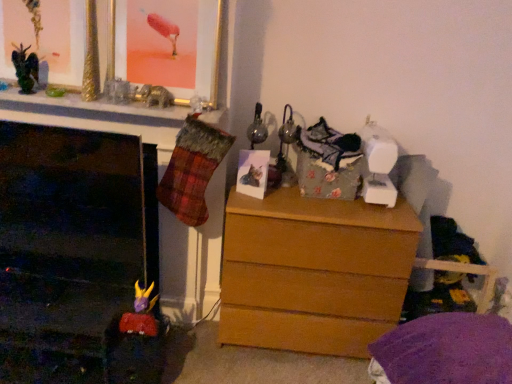
In order to face matte paper photo at center, the 2th picture frame viewed from the top, should I rotate leftwards or rightwards?

Turn right by 0.031 degrees to look at matte paper photo at center, the 2th picture frame viewed from the top.

This screenshot has height=384, width=512. What do you see at coordinates (313, 272) in the screenshot?
I see `light brown wood chest of drawers at center` at bounding box center [313, 272].

Locate an element on the screen. Image resolution: width=512 pixels, height=384 pixels. matte paper photo at center, which is the 2th picture frame in left-to-right order is located at coordinates (253, 172).

Can you confirm if gold metallic picture frame at upper center, the 2th picture frame viewed from the right, is taller than matte paper photo at center, the 1th picture frame in the right-to-left sequence?

Yes, gold metallic picture frame at upper center, the 2th picture frame viewed from the right, is taller than matte paper photo at center, the 1th picture frame in the right-to-left sequence.

Can we say gold metallic picture frame at upper center, marked as the first picture frame in a top-to-bottom arrangement, lies outside matte paper photo at center, the 2th picture frame viewed from the top?

That's correct, gold metallic picture frame at upper center, marked as the first picture frame in a top-to-bottom arrangement, is outside of matte paper photo at center, the 2th picture frame viewed from the top.

Looking at the image, does gold metallic picture frame at upper center, marked as the first picture frame in a top-to-bottom arrangement, seem bigger or smaller compared to matte paper photo at center, the 2th picture frame viewed from the top?

Considering their sizes, gold metallic picture frame at upper center, marked as the first picture frame in a top-to-bottom arrangement, takes up more space than matte paper photo at center, the 2th picture frame viewed from the top.

From the image's perspective, who appears lower, matte paper photo at center, which is the 1th picture frame from bottom to top, or metallic black dragon at upper left?

matte paper photo at center, which is the 1th picture frame from bottom to top.

Is matte paper photo at center, the 1th picture frame in the right-to-left sequence, oriented towards metallic black dragon at upper left?

No, matte paper photo at center, the 1th picture frame in the right-to-left sequence, is not turned towards metallic black dragon at upper left.

Which point is more forward, (263, 195) or (25, 92)?

The point (25, 92) is closer.

From the image's perspective, is matte paper photo at center, which is the 1th picture frame from bottom to top, above gold metallic picture frame at upper center, marked as the first picture frame in a top-to-bottom arrangement?

No, from the image's perspective, matte paper photo at center, which is the 1th picture frame from bottom to top, is not above gold metallic picture frame at upper center, marked as the first picture frame in a top-to-bottom arrangement.

Consider the image. Between matte paper photo at center, which is the 2th picture frame in left-to-right order, and gold metallic picture frame at upper center, the 2th picture frame viewed from the right, which one appears on the left side from the viewer's perspective?

gold metallic picture frame at upper center, the 2th picture frame viewed from the right, is more to the left.

Between matte paper photo at center, which is the 1th picture frame from bottom to top, and gold metallic picture frame at upper center, arranged as the first picture frame when viewed from the left, which one has smaller size?

matte paper photo at center, which is the 1th picture frame from bottom to top, is smaller.

From a real-world perspective, relative to matte paper photo at center, the 2th picture frame viewed from the top, is metallic black dragon at upper left vertically above or below?

metallic black dragon at upper left is above matte paper photo at center, the 2th picture frame viewed from the top.

You are a GUI agent. You are given a task and a screenshot of the screen. Output one action in this format:
    pyautogui.click(x=<x>, y=<y>)
    Task: Click on the toy lying above the matte paper photo at center, which is the 1th picture frame from bottom to top (from the image's perspective)
    The image size is (512, 384).
    Given the screenshot: What is the action you would take?
    pyautogui.click(x=25, y=68)

Does point (22, 62) appear closer or farther from the camera than point (259, 170)?

Point (22, 62).

Which of these two, light brown wood chest of drawers at center or gold metallic picture frame at upper center, placed as the second picture frame when sorted from bottom to top, is smaller?

gold metallic picture frame at upper center, placed as the second picture frame when sorted from bottom to top.

Is point (231, 249) positioned behind point (134, 47)?

Yes, point (231, 249) is behind point (134, 47).

Between light brown wood chest of drawers at center and gold metallic picture frame at upper center, arranged as the first picture frame when viewed from the left, which one has more height?

With more height is light brown wood chest of drawers at center.

From a real-world perspective, count 2nd picture frames upward from the light brown wood chest of drawers at center and point to it. Please provide its 2D coordinates.

[(170, 46)]

Is the depth of matte paper photo at center, the 1th picture frame in the right-to-left sequence, greater than that of light brown wood chest of drawers at center?

That is True.

Is matte paper photo at center, which is the 1th picture frame from bottom to top, inside or outside of light brown wood chest of drawers at center?

matte paper photo at center, which is the 1th picture frame from bottom to top, cannot be found inside light brown wood chest of drawers at center.

Considering the sizes of matte paper photo at center, which is the 2th picture frame in left-to-right order, and light brown wood chest of drawers at center in the image, is matte paper photo at center, which is the 2th picture frame in left-to-right order, bigger or smaller than light brown wood chest of drawers at center?

Clearly, matte paper photo at center, which is the 2th picture frame in left-to-right order, is smaller in size than light brown wood chest of drawers at center.

Would you consider matte paper photo at center, which is the 1th picture frame from bottom to top, to be distant from light brown wood chest of drawers at center?

They are positioned close to each other.

Which object is wider, light brown wood chest of drawers at center or metallic black dragon at upper left?

light brown wood chest of drawers at center is wider.

What's the angular difference between light brown wood chest of drawers at center and metallic black dragon at upper left's facing directions?

There is a 0.484-degree angle between the facing directions of light brown wood chest of drawers at center and metallic black dragon at upper left.

Consider the image. Is light brown wood chest of drawers at center at the right side of metallic black dragon at upper left?

Correct, you'll find light brown wood chest of drawers at center to the right of metallic black dragon at upper left.

Which point is more distant from viewer, (280, 344) or (29, 62)?

Point (280, 344)

Find the location of a particular element. The width and height of the screenshot is (512, 384). picture frame on the right of the gold metallic picture frame at upper center, the 2th picture frame viewed from the right is located at coordinates (253, 172).

Find the location of a particular element. This screenshot has height=384, width=512. picture frame behind the metallic black dragon at upper left is located at coordinates (253, 172).

In the scene shown: Which object lies further to the anchor point light brown wood chest of drawers at center, matte paper photo at center, the 1th picture frame in the right-to-left sequence, or gold metallic picture frame at upper center, the 2th picture frame viewed from the right?

gold metallic picture frame at upper center, the 2th picture frame viewed from the right, is positioned further to the anchor light brown wood chest of drawers at center.

Considering their positions, is metallic black dragon at upper left positioned further to gold metallic picture frame at upper center, placed as the second picture frame when sorted from bottom to top, than matte paper photo at center, which is the 2th picture frame in left-to-right order?

metallic black dragon at upper left is positioned further to the anchor gold metallic picture frame at upper center, placed as the second picture frame when sorted from bottom to top.

Looking at the image, which one is located closer to gold metallic picture frame at upper center, arranged as the first picture frame when viewed from the left, metallic black dragon at upper left or light brown wood chest of drawers at center?

The object closer to gold metallic picture frame at upper center, arranged as the first picture frame when viewed from the left, is metallic black dragon at upper left.

Based on their spatial positions, is gold metallic picture frame at upper center, arranged as the first picture frame when viewed from the left, or light brown wood chest of drawers at center further from matte paper photo at center, the 2th picture frame viewed from the top?

gold metallic picture frame at upper center, arranged as the first picture frame when viewed from the left, lies further to matte paper photo at center, the 2th picture frame viewed from the top, than the other object.

Estimate the real-world distances between objects in this image. Which object is closer to matte paper photo at center, the 1th picture frame in the right-to-left sequence, light brown wood chest of drawers at center or gold metallic picture frame at upper center, placed as the second picture frame when sorted from bottom to top?

light brown wood chest of drawers at center is closer to matte paper photo at center, the 1th picture frame in the right-to-left sequence.

Looking at the image, which one is located further to gold metallic picture frame at upper center, placed as the second picture frame when sorted from bottom to top, matte paper photo at center, which is the 2th picture frame in left-to-right order, or light brown wood chest of drawers at center?

light brown wood chest of drawers at center.

From the image, which object appears to be nearer to metallic black dragon at upper left, light brown wood chest of drawers at center or matte paper photo at center, which is the 2th picture frame in left-to-right order?

Among the two, matte paper photo at center, which is the 2th picture frame in left-to-right order, is located nearer to metallic black dragon at upper left.

Considering their positions, is matte paper photo at center, which is the 1th picture frame from bottom to top, positioned closer to metallic black dragon at upper left than light brown wood chest of drawers at center?

matte paper photo at center, which is the 1th picture frame from bottom to top, lies closer to metallic black dragon at upper left than the other object.

Image resolution: width=512 pixels, height=384 pixels. I want to click on picture frame situated between metallic black dragon at upper left and matte paper photo at center, the 2th picture frame viewed from the top, from left to right, so click(170, 46).

Image resolution: width=512 pixels, height=384 pixels. What are the coordinates of `picture frame that lies between gold metallic picture frame at upper center, arranged as the first picture frame when viewed from the left, and light brown wood chest of drawers at center from top to bottom` in the screenshot? It's located at pyautogui.click(x=253, y=172).